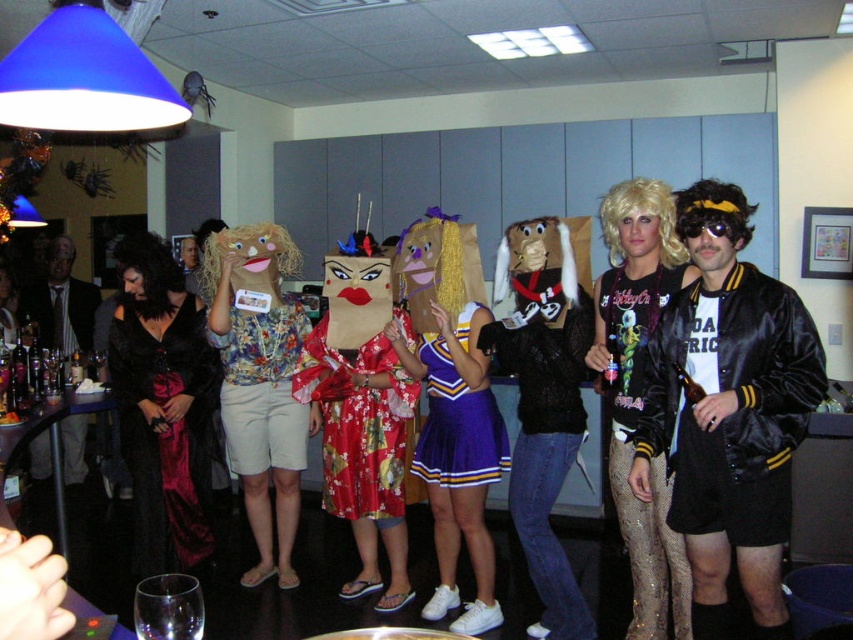
Question: Can you confirm if shiny metallic wig at center is positioned to the left of matte black suit at left?

Choices:
 (A) no
 (B) yes

Answer: (A)

Question: Does satin black bomber jacket at center right lie in front of floral silk kimono at center?

Choices:
 (A) yes
 (B) no

Answer: (A)

Question: Which point is farther from the camera taking this photo?

Choices:
 (A) pos(410,300)
 (B) pos(624,417)
 (C) pos(438,445)
 (D) pos(151,529)

Answer: (D)

Question: Estimate the real-world distances between objects in this image. Which object is farther from the matte black jacket at center?

Choices:
 (A) purple fabric cheerleader skirt at center
 (B) purple satin cheerleader outfit at center
 (C) satin black bomber jacket at center right
 (D) shiny metallic wig at center

Answer: (C)

Question: Is matte paper bag mask at center above purple fabric cheerleader skirt at center?

Choices:
 (A) yes
 (B) no

Answer: (B)

Question: Which point is closer to the camera?

Choices:
 (A) purple fabric cheerleader skirt at center
 (B) matte black jacket at center

Answer: (B)